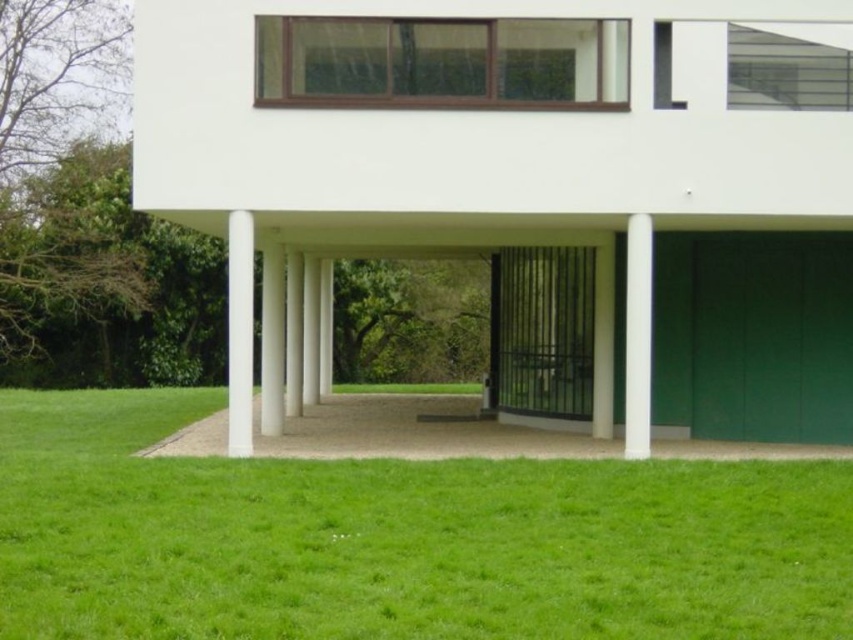
Question: Is white smooth garage at center above black metal gate at center?

Choices:
 (A) no
 (B) yes

Answer: (A)

Question: Which point is closer to the camera taking this photo?

Choices:
 (A) (635, 436)
 (B) (142, 44)
 (C) (252, 337)

Answer: (C)

Question: Does green matte/glossy garage door at lower right appear over white smooth pillar at center?

Choices:
 (A) no
 (B) yes

Answer: (A)

Question: Among these objects, which one is nearest to the camera?

Choices:
 (A) white smooth garage at center
 (B) white smooth pillar at center
 (C) black metal gate at center

Answer: (B)

Question: Which object is positioned closest to the black metal gate at center?

Choices:
 (A) white smooth pillar at center
 (B) green matte/glossy garage door at lower right

Answer: (B)

Question: Can you confirm if green grass at lower center is positioned to the right of green matte/glossy garage door at lower right?

Choices:
 (A) no
 (B) yes

Answer: (A)